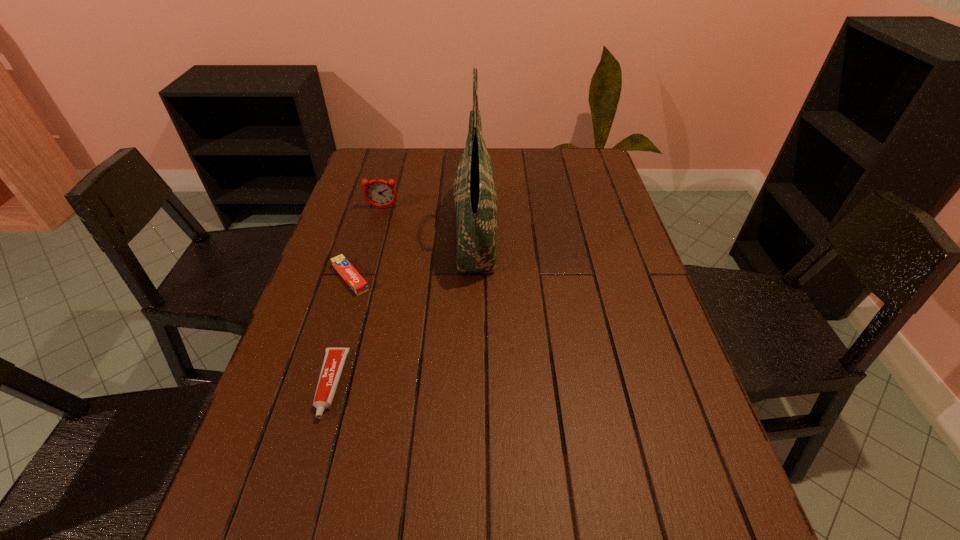
You are a GUI agent. You are given a task and a screenshot of the screen. Output one action in this format:
    pyautogui.click(x=<x>, y=<y>)
    Task: Click on the empty location between the second shortest object and the tallest object
    The image size is (960, 540).
    Given the screenshot: What is the action you would take?
    pyautogui.click(x=402, y=309)

Identify the location of empty location between the nearest object and the second tallest object. The height and width of the screenshot is (540, 960). (356, 296).

Where is `free point between the shorter toothpaste and the third shortest object`? free point between the shorter toothpaste and the third shortest object is located at coordinates (367, 243).

Locate an element on the screen. free space that is in between the nearest object and the alarm clock is located at coordinates (356, 296).

Identify the location of empty space between the farther toothpaste and the third tallest object. The image size is (960, 540). (341, 331).

Locate an element on the screen. object that is the closest to the nearest object is located at coordinates (357, 283).

Where is `object that is the closest one to the shortest object`? object that is the closest one to the shortest object is located at coordinates (334, 359).

The width and height of the screenshot is (960, 540). I want to click on free spot that satisfies the following two spatial constraints: 1. on the front-facing side of the second tallest object; 2. on the left side of the rightmost object, so click(x=375, y=233).

This screenshot has height=540, width=960. Identify the location of blank space that satisfies the following two spatial constraints: 1. on the front-facing side of the tallest object; 2. on the right side of the alarm clock. (375, 233).

Find the location of a particular element. The width and height of the screenshot is (960, 540). free point that satisfies the following two spatial constraints: 1. on the back side of the shorter toothpaste; 2. on the left side of the tallest object is located at coordinates (364, 233).